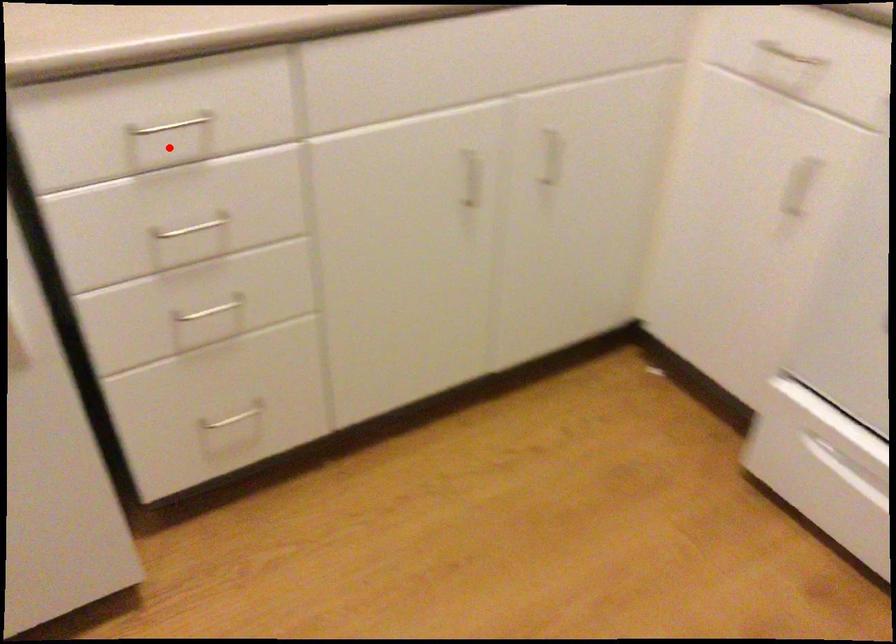
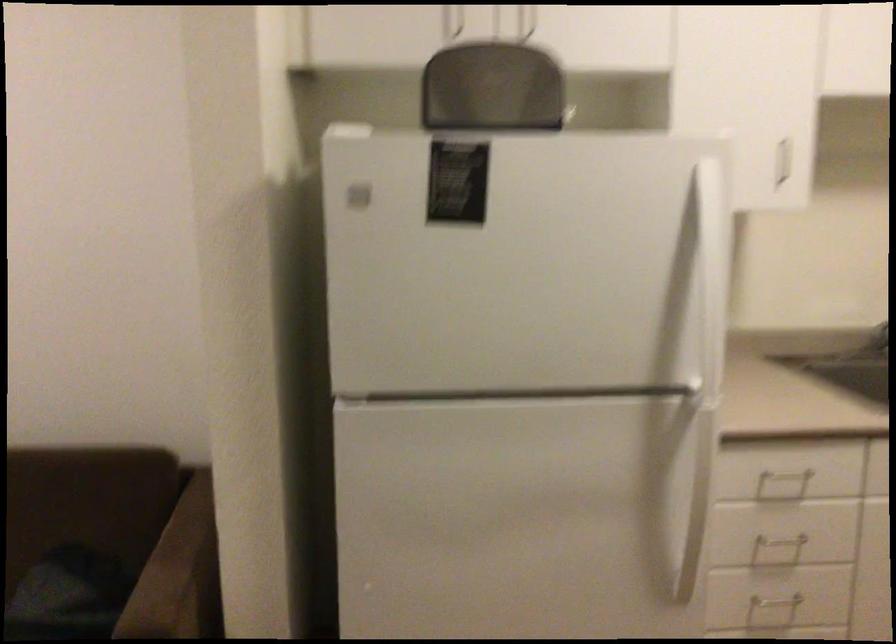
Question: I am providing you with two images of the same scene from different viewpoints. A red point is marked on the first image. At the location where the point appears in image 1, is it still visible in image 2?

Choices:
 (A) Yes
 (B) No

Answer: (A)